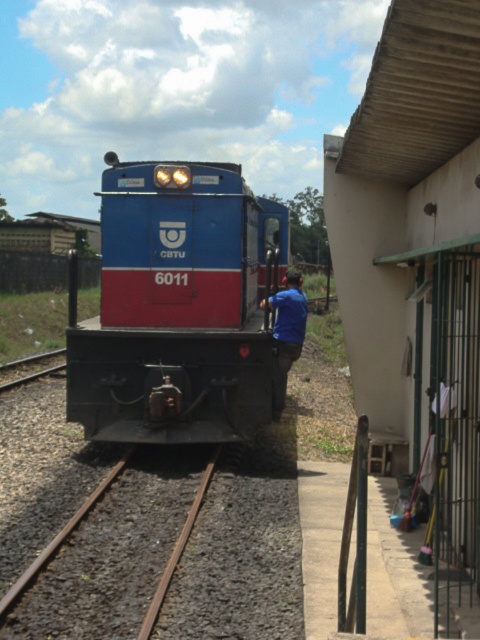
Who is positioned more to the left, blue glossy locomotive at center or blue fabric shirt at center?

Positioned to the left is blue glossy locomotive at center.

Between point (206, 237) and point (276, 397), which one is positioned in front?

Positioned in front is point (206, 237).

Where is `blue glossy locomotive at center`? The image size is (480, 640). blue glossy locomotive at center is located at coordinates (182, 308).

Consider the image. Between concrete wall at right and blue fabric shirt at center, which one has more height?

concrete wall at right

Is concrete wall at right wider than blue fabric shirt at center?

Yes.

At what (x,y) coordinates should I click in order to perform the action: click on concrete wall at right. Please return your answer as a coordinate pair (x, y). Looking at the image, I should click on (418, 260).

Is the position of brown rusted metal train track at lower left less distant than that of blue fabric shirt at center?

Yes, it is in front of blue fabric shirt at center.

Who is positioned more to the right, brown rusted metal train track at lower left or blue fabric shirt at center?

Positioned to the right is blue fabric shirt at center.

Between point (93, 616) and point (291, 349), which one is positioned behind?

The point (291, 349) is behind.

The image size is (480, 640). Identify the location of brown rusted metal train track at lower left. (109, 560).